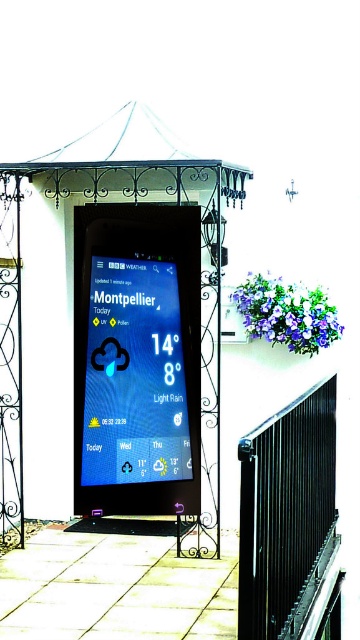
Question: Is matte blue screen at center below black metal/rail at lower right?

Choices:
 (A) yes
 (B) no

Answer: (B)

Question: Which point is closer to the camera?

Choices:
 (A) black wrought iron canopy at upper center
 (B) black metal/rail at lower right
 (C) matte blue screen at center

Answer: (B)

Question: Among these objects, which one is farthest from the camera?

Choices:
 (A) black metal/rail at lower right
 (B) matte blue screen at center
 (C) black wrought iron canopy at upper center

Answer: (C)

Question: Is matte blue screen at center closer to the viewer compared to black wrought iron canopy at upper center?

Choices:
 (A) yes
 (B) no

Answer: (A)

Question: Which object appears closest to the camera in this image?

Choices:
 (A) black wrought iron canopy at upper center
 (B) matte blue screen at center

Answer: (B)

Question: Can you confirm if matte blue screen at center is wider than black metal/rail at lower right?

Choices:
 (A) no
 (B) yes

Answer: (A)